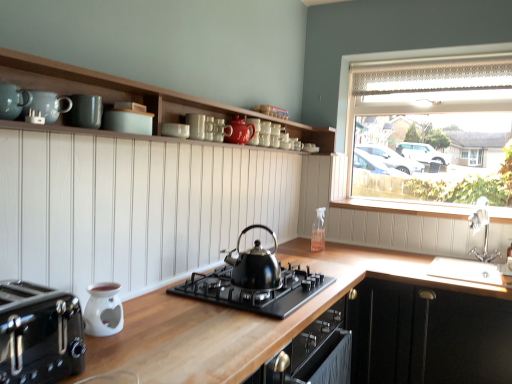
Identify the location of free spot behind white ceramic oil burner at lower left, the first kitchen appliance viewed from the back. (141, 311).